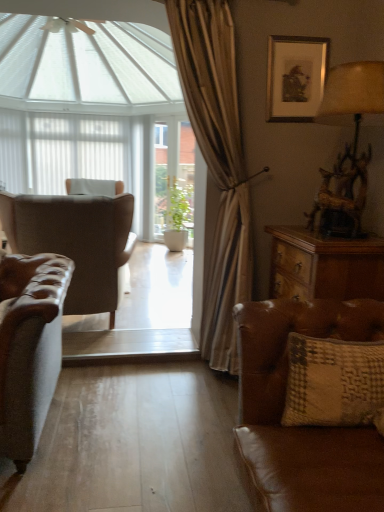
What do you see at coordinates (177, 216) in the screenshot? I see `green matte plant at center` at bounding box center [177, 216].

The image size is (384, 512). Describe the element at coordinates (13, 151) in the screenshot. I see `white matte shutter at left` at that location.

Measure the distance between point (15,178) and camera.

Point (15,178) and camera are 5.53 meters apart from each other.

What is the approximate width of white sheer curtain at upper center?

white sheer curtain at upper center is 4.56 inches in width.

Describe the element at coordinates (76, 241) in the screenshot. I see `leather wingback chair at left` at that location.

What is the approximate width of textured beige pillow at lower right?

textured beige pillow at lower right is 6.85 inches in width.

Measure the distance between point (x=303, y=80) and camera.

A distance of 2.48 meters exists between point (x=303, y=80) and camera.

Consider the image. Measure the distance between silver metallic picture frame at upper right and camera.

7.93 feet.

This screenshot has width=384, height=512. What are the coordinates of `green matte plant at center` in the screenshot? It's located at (177, 216).

Can you confirm if green matte plant at center is thinner than wooden drawer at right?

Indeed, green matte plant at center has a lesser width compared to wooden drawer at right.

Is green matte plant at center to the right of wooden drawer at right from the viewer's perspective?

No, green matte plant at center is not to the right of wooden drawer at right.

Where is `houseplant on the left of wooden drawer at right`? The image size is (384, 512). houseplant on the left of wooden drawer at right is located at coordinates (177, 216).

From the image's perspective, is textured beige pillow at lower right positioned above or below brown leather couch at lower right?

textured beige pillow at lower right is above brown leather couch at lower right.

Considering the relative positions of textured beige pillow at lower right and brown leather couch at lower right in the image provided, is textured beige pillow at lower right to the left or to the right of brown leather couch at lower right?

textured beige pillow at lower right is to the right of brown leather couch at lower right.

Is textured beige pillow at lower right thinner than brown leather couch at lower right?

Indeed, textured beige pillow at lower right has a lesser width compared to brown leather couch at lower right.

In the scene shown: Between leather wingback chair at left and wooden drawer at right, which one appears on the left side from the viewer's perspective?

leather wingback chair at left is more to the left.

From a real-world perspective, is leather wingback chair at left physically above wooden drawer at right?

No, from a real-world perspective, leather wingback chair at left is not on top of wooden drawer at right.

Considering the relative sizes of leather wingback chair at left and wooden drawer at right in the image provided, is leather wingback chair at left thinner than wooden drawer at right?

Incorrect, the width of leather wingback chair at left is not less than that of wooden drawer at right.

Is point (2, 192) positioned in front of point (363, 250)?

No, it is behind (363, 250).

Consider the image. Are silver metallic picture frame at upper right and leather wingback chair at left making contact?

No, silver metallic picture frame at upper right is not next to leather wingback chair at left.

From the image's perspective, who appears lower, silver metallic picture frame at upper right or leather wingback chair at left?

leather wingback chair at left.

How many degrees apart are the facing directions of silver metallic picture frame at upper right and leather wingback chair at left?

The angular difference between silver metallic picture frame at upper right and leather wingback chair at left is 179 degrees.

Which point is more distant from viewer, (321, 66) or (9, 214)?

The point (9, 214) is farther.

Considering their positions, is textured beige pillow at lower right located in front of or behind leather wingback chair at left?

textured beige pillow at lower right is positioned closer to the viewer than leather wingback chair at left.

From a real-world perspective, which object rests below the other?

leather wingback chair at left is physically lower.

Considering the relative positions of textured beige pillow at lower right and leather wingback chair at left in the image provided, is textured beige pillow at lower right to the right of leather wingback chair at left from the viewer's perspective?

Indeed, textured beige pillow at lower right is positioned on the right side of leather wingback chair at left.

Which of these two, brown leather couch at lower right or silver metallic picture frame at upper right, stands shorter?

silver metallic picture frame at upper right.

Is brown leather couch at lower right positioned with its back to silver metallic picture frame at upper right?

No, brown leather couch at lower right is not facing the opposite direction of silver metallic picture frame at upper right.

The height and width of the screenshot is (512, 384). I want to click on picture frame lying above the brown leather couch at lower right (from the image's perspective), so click(x=295, y=77).

From the image's perspective, which object appears higher, wooden drawer at right or brown leather couch at lower right?

wooden drawer at right, from the image's perspective.

The image size is (384, 512). Find the location of `desk that is above the brown leather couch at lower right (from a real-world perspective)`. desk that is above the brown leather couch at lower right (from a real-world perspective) is located at coordinates (324, 266).

From a real-world perspective, which is physically below, wooden drawer at right or brown leather couch at lower right?

From a 3D spatial view, brown leather couch at lower right is below.

Is wooden drawer at right to the left of brown leather couch at lower right from the viewer's perspective?

In fact, wooden drawer at right is to the right of brown leather couch at lower right.

Locate an element on the screen. houseplant behind the wooden drawer at right is located at coordinates (177, 216).

This screenshot has height=512, width=384. Find the location of `studio couch below the textured beige pillow at lower right (from the image's perspective)`. studio couch below the textured beige pillow at lower right (from the image's perspective) is located at coordinates (302, 426).

From the image, which object appears to be farther from white sheer curtain at upper center, brown leather couch at lower right or wooden drawer at right?

Among the two, brown leather couch at lower right is located further to white sheer curtain at upper center.

Looking at this image, considering their positions, is wooden textured lamp at upper right positioned closer to wooden drawer at right than brown leather couch at lower right?

brown leather couch at lower right.

Considering their positions, is white matte shutter at left positioned further to wooden drawer at right than textured beige pillow at lower right?

The object further to wooden drawer at right is white matte shutter at left.

Which object lies further to the anchor point brown leather couch at lower right, wooden drawer at right or wooden textured lamp at upper right?

Based on the image, wooden textured lamp at upper right appears to be further to brown leather couch at lower right.

Estimate the real-world distances between objects in this image. Which object is further from wooden textured lamp at upper right, green matte plant at center or textured beige pillow at lower right?

Based on the image, green matte plant at center appears to be further to wooden textured lamp at upper right.

Looking at the image, which one is located further to brown leather couch at lower right, wooden drawer at right or white matte shutter at left?

The object further to brown leather couch at lower right is white matte shutter at left.

Based on their spatial positions, is white sheer curtain at upper center or white matte shutter at left closer to silver metallic picture frame at upper right?

The object closer to silver metallic picture frame at upper right is white sheer curtain at upper center.

Estimate the real-world distances between objects in this image. Which object is closer to wooden drawer at right, wooden textured lamp at upper right or leather wingback chair at left?

wooden textured lamp at upper right.

Locate an element on the screen. This screenshot has width=384, height=512. chair between textured beige pillow at lower right and white sheer curtain at upper center from front to back is located at coordinates (76, 241).

In order to click on chair between brown leather couch at lower right and white matte shutter at left along the z-axis in this screenshot , I will do `click(76, 241)`.

The width and height of the screenshot is (384, 512). Find the location of `houseplant between silver metallic picture frame at upper right and white matte shutter at left along the z-axis`. houseplant between silver metallic picture frame at upper right and white matte shutter at left along the z-axis is located at coordinates (177, 216).

Where is `pillow between leather wingback chair at left and silver metallic picture frame at upper right from left to right`? pillow between leather wingback chair at left and silver metallic picture frame at upper right from left to right is located at coordinates (334, 383).